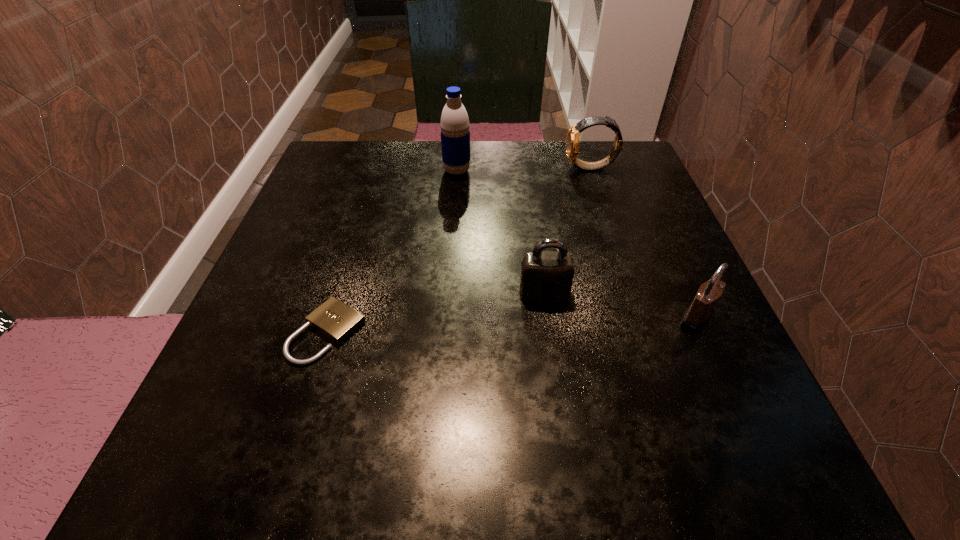
Locate an element on the screen. The height and width of the screenshot is (540, 960). the tallest object is located at coordinates (455, 134).

The image size is (960, 540). Identify the location of water bottle. (455, 134).

At what (x,y) coordinates should I click in order to perform the action: click on watch. Please return your answer as a coordinate pair (x, y). The height and width of the screenshot is (540, 960). Looking at the image, I should click on (572, 143).

This screenshot has height=540, width=960. What are the coordinates of `the second padlock from right to left` in the screenshot? It's located at (546, 276).

The image size is (960, 540). I want to click on the rightmost padlock, so [698, 314].

The height and width of the screenshot is (540, 960). I want to click on the leftmost padlock, so click(x=334, y=319).

You are a GUI agent. You are given a task and a screenshot of the screen. Output one action in this format:
    pyautogui.click(x=<x>, y=<y>)
    Task: Click on the shortest padlock
    
    Given the screenshot: What is the action you would take?
    pyautogui.click(x=334, y=319)

Locate an element on the screen. free spot located 0.160m on the left of the second object from left to right is located at coordinates (373, 171).

Identify the location of vacant area situated 0.370m on the face of the watch. (406, 168).

Where is `vacant space situated on the face of the watch`? The width and height of the screenshot is (960, 540). vacant space situated on the face of the watch is located at coordinates (415, 168).